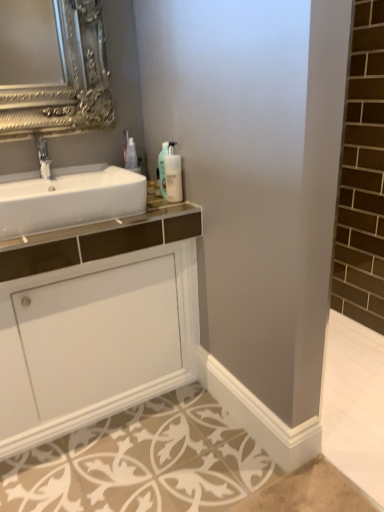
Question: Considering the positions of white glossy cabinet at center and translucent plastic soap dispenser at upper center, the second soap dispenser from the right, in the image, is white glossy cabinet at center wider or thinner than translucent plastic soap dispenser at upper center, the second soap dispenser from the right,?

Choices:
 (A) wide
 (B) thin

Answer: (A)

Question: Do you think white glossy cabinet at center is within translucent plastic soap dispenser at upper center, the second soap dispenser from the right, or outside of it?

Choices:
 (A) outside
 (B) inside

Answer: (A)

Question: Considering the real-world distances, which object is farthest from the translucent plastic soap dispenser at upper center, the second soap dispenser from the right?

Choices:
 (A) translucent plastic bottle at upper right
 (B) white glossy sink at left
 (C) matte silver faucet at left
 (D) white painted wood baseboard at lower center
 (E) translucent plastic soap dispenser at upper center, the 2th soap dispenser from the left

Answer: (D)

Question: Which of these objects is positioned closest to the translucent plastic bottle at upper right?

Choices:
 (A) white glossy cabinet at center
 (B) matte silver faucet at left
 (C) translucent plastic soap dispenser at upper center, the second soap dispenser from the right
 (D) translucent plastic soap dispenser at upper center, the 2th soap dispenser from the left
 (E) white painted wood baseboard at lower center

Answer: (C)